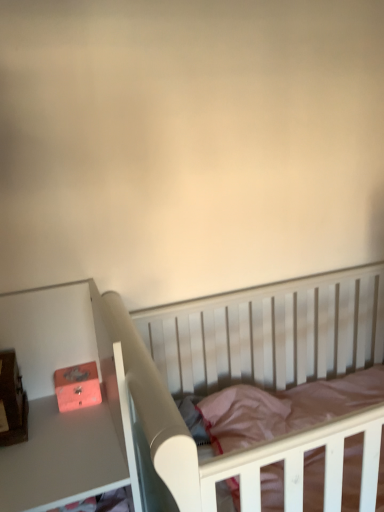
Question: From a real-world perspective, is matte orange box at left physically located above or below white wood crib at center?

Choices:
 (A) above
 (B) below

Answer: (A)

Question: Considering the positions of matte orange box at left and white wood crib at center in the image, is matte orange box at left bigger or smaller than white wood crib at center?

Choices:
 (A) big
 (B) small

Answer: (B)

Question: Based on their relative distances, which object is farther from the matte pink drawer at left?

Choices:
 (A) white wood crib at center
 (B) matte orange box at left

Answer: (A)

Question: Which of these objects is positioned closest to the matte pink drawer at left?

Choices:
 (A) white wood crib at center
 (B) matte orange box at left

Answer: (B)